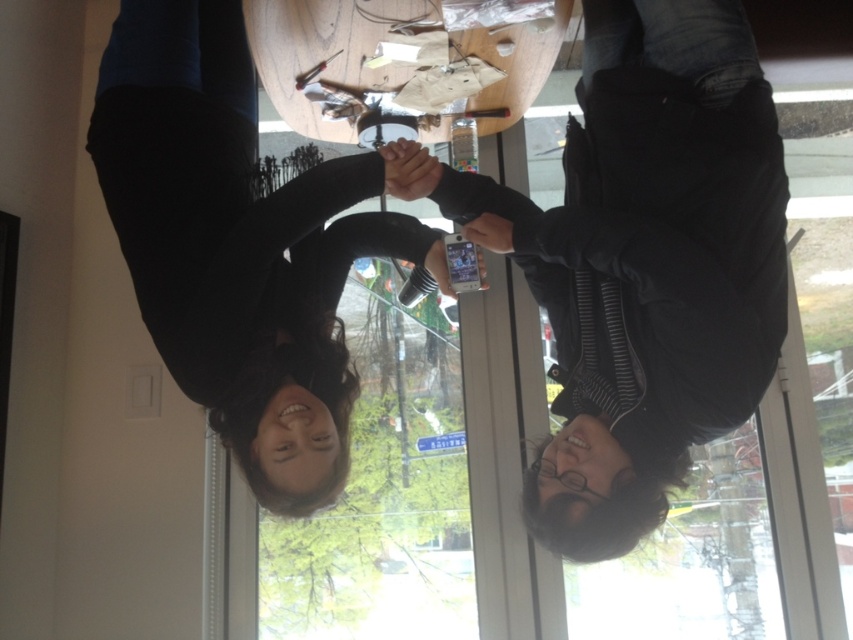
Is matte black phone at center shorter than black matte hair at upper center?

No.

In the scene shown: Is matte black phone at center to the left of black matte hair at upper center from the viewer's perspective?

No, matte black phone at center is not to the left of black matte hair at upper center.

Is point (752, 77) less distant than point (210, 22)?

Yes, it is.

The image size is (853, 640). I want to click on matte black phone at center, so click(645, 262).